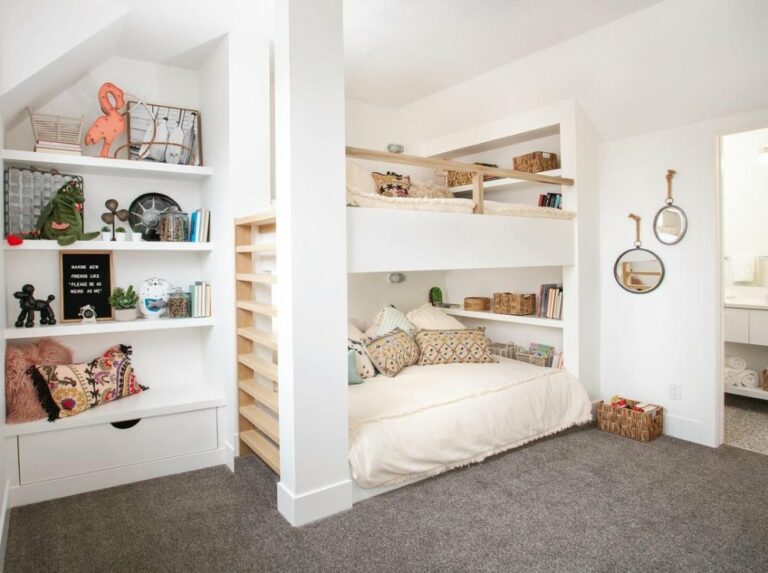
Find the location of `basket on floor`. basket on floor is located at coordinates pyautogui.click(x=620, y=423).